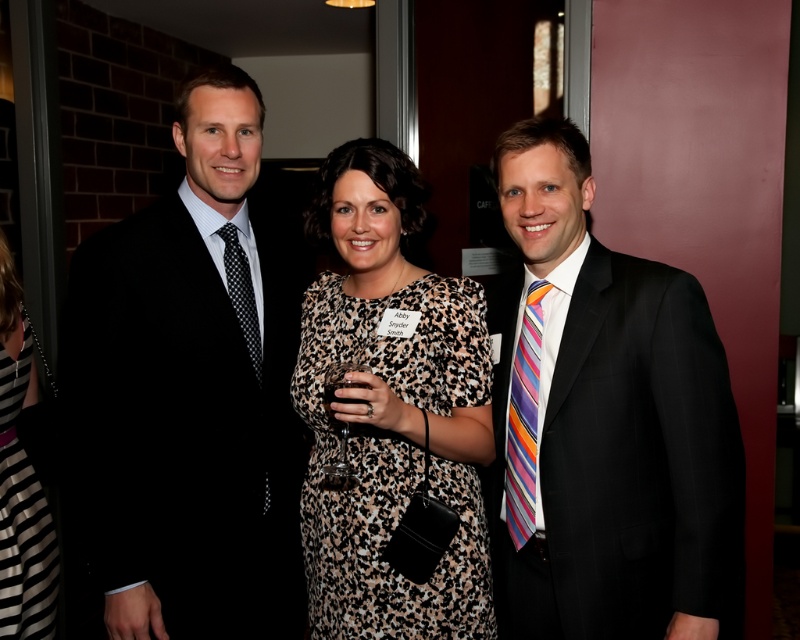
Question: Which object is closer to the camera taking this photo?

Choices:
 (A) striped silk tie at right
 (B) black and white striped dress at lower left

Answer: (A)

Question: Among these points, which one is farthest from the camera?

Choices:
 (A) (196, 276)
 (B) (666, 616)
 (C) (390, 333)

Answer: (A)

Question: Is black silk suit at left thinner than striped silk tie at right?

Choices:
 (A) no
 (B) yes

Answer: (A)

Question: Which object appears farthest from the camera in this image?

Choices:
 (A) black pinstripe suit at right
 (B) striped silk tie at right
 (C) black dotted tie at left
 (D) black and white striped dress at lower left

Answer: (D)

Question: Can you confirm if leopard print dress at center is positioned above black dotted tie at left?

Choices:
 (A) no
 (B) yes

Answer: (A)

Question: Is black and white striped dress at lower left closer to the viewer compared to striped silk tie at right?

Choices:
 (A) yes
 (B) no

Answer: (B)